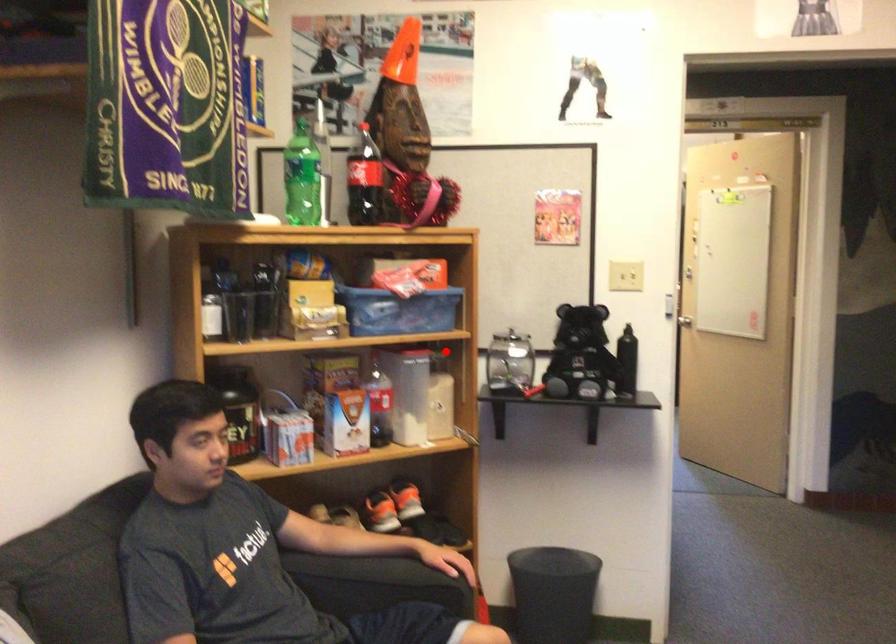
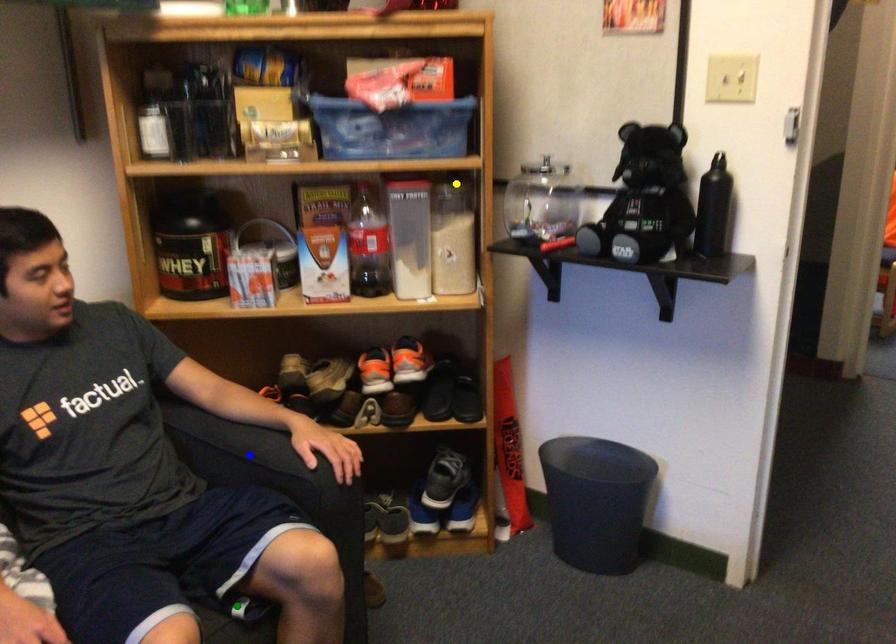
Question: I am providing you with two images of the same scene from different viewpoints. A red point is marked on the first image. You are given multiple points on the second image. Which point in image 2 is actually the same real-world point as the red point in image 1?

Choices:
 (A) green point
 (B) blue point
 (C) yellow point

Answer: (C)